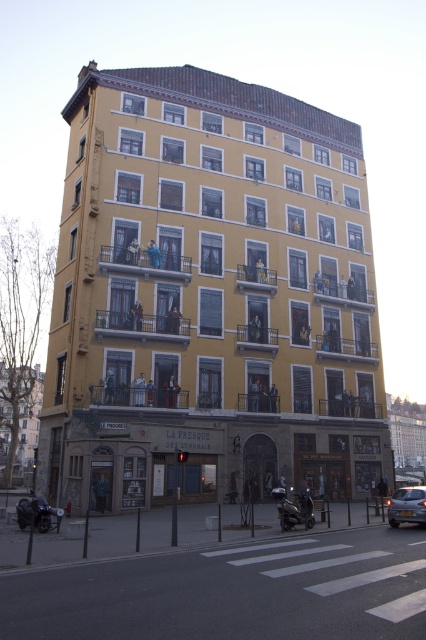
Is metallic silver car at lower right positioned behind shiny black motorcycle at lower left?

Yes, metallic silver car at lower right is further from the viewer.

Can you confirm if metallic silver car at lower right is positioned above shiny black motorcycle at lower left?

Yes.

You are a GUI agent. You are given a task and a screenshot of the screen. Output one action in this format:
    pyautogui.click(x=<x>, y=<y>)
    Task: Click on the metallic silver car at lower right
    This screenshot has height=640, width=426.
    Given the screenshot: What is the action you would take?
    pyautogui.click(x=406, y=506)

Does shiny black motorcycle at lower left have a smaller size compared to shiny black motorcycle at lower center?

Incorrect, shiny black motorcycle at lower left is not smaller in size than shiny black motorcycle at lower center.

Is shiny black motorcycle at lower left wider than shiny black motorcycle at lower center?

Yes.

Find the location of `shiny black motorcycle at lower left`. shiny black motorcycle at lower left is located at coordinates (37, 513).

Between metallic silver car at lower right and shiny black motorcycle at lower center, which one appears on the left side from the viewer's perspective?

Positioned to the left is shiny black motorcycle at lower center.

Is metallic silver car at lower right taller than shiny black motorcycle at lower center?

No.

Where is `metallic silver car at lower right`? This screenshot has width=426, height=640. metallic silver car at lower right is located at coordinates (406, 506).